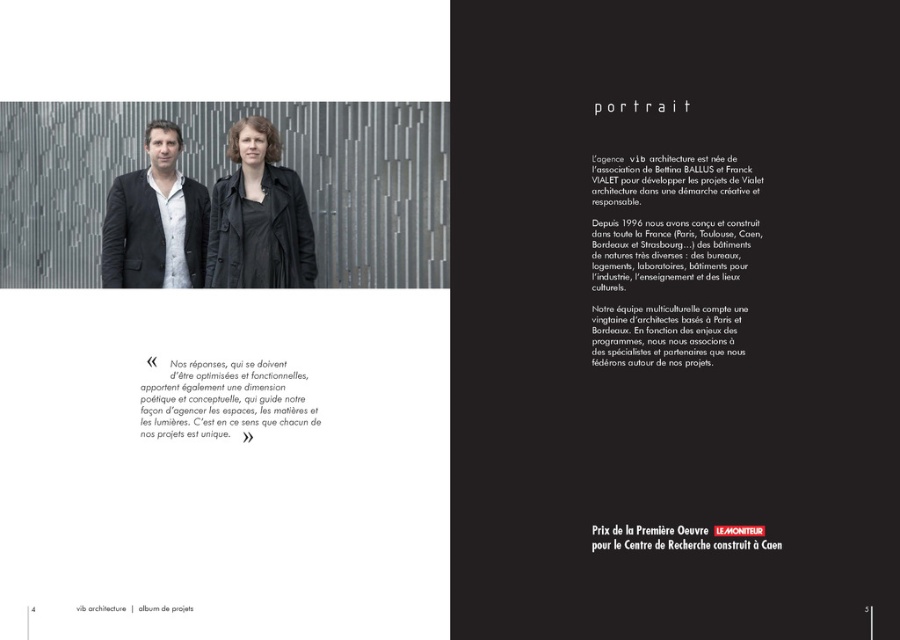
Question: Based on their relative distances, which object is nearer to the matte black jacket at center?

Choices:
 (A) black paper quote at center
 (B) black matte jacket at center

Answer: (B)

Question: Is black matte jacket at center closer to camera compared to black paper quote at center?

Choices:
 (A) no
 (B) yes

Answer: (A)

Question: Which point is farther to the camera?

Choices:
 (A) black matte jacket at center
 (B) black paper quote at center

Answer: (A)

Question: Which of these objects is positioned closest to the black paper quote at center?

Choices:
 (A) matte black jacket at center
 (B) black matte jacket at center

Answer: (B)

Question: Does black matte jacket at center appear on the left side of matte black jacket at center?

Choices:
 (A) yes
 (B) no

Answer: (B)

Question: Is black matte jacket at center bigger than black paper quote at center?

Choices:
 (A) yes
 (B) no

Answer: (A)